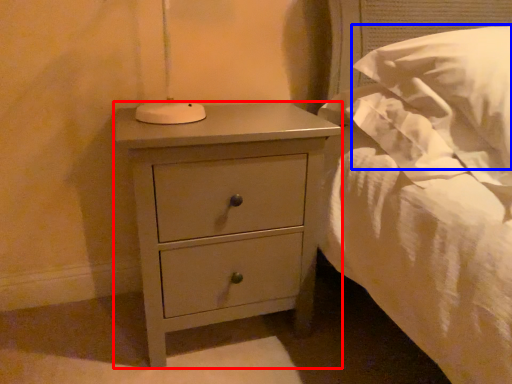
Question: Which point is closer to the camera, nightstand (highlighted by a red box) or pillow (highlighted by a blue box)?

Choices:
 (A) nightstand
 (B) pillow

Answer: (B)